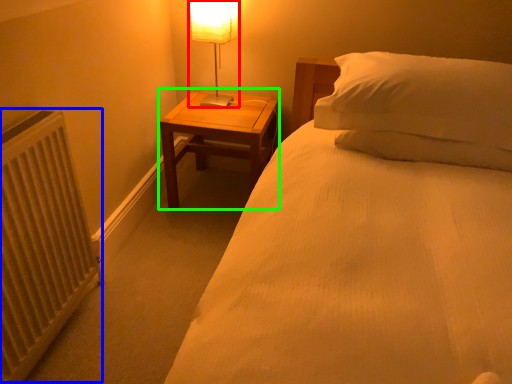
Question: Considering the real-world distances, which object is closest to table lamp (highlighted by a red box)? radiator (highlighted by a blue box) or nightstand (highlighted by a green box).

Choices:
 (A) radiator
 (B) nightstand

Answer: (B)